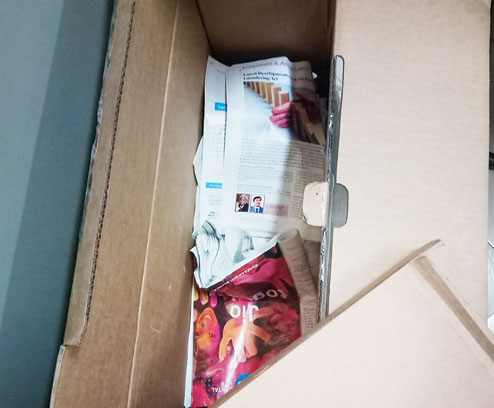
I want to click on blue wall, so click(37, 158).